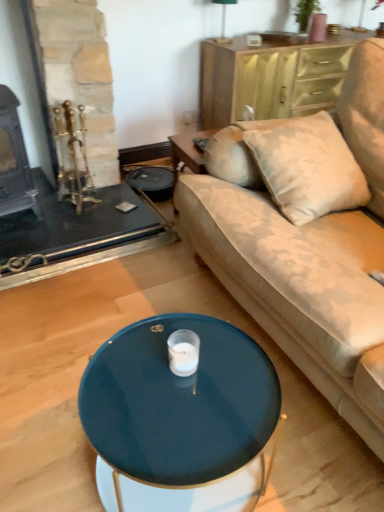
Question: Considering their positions, is velvet beige couch at center located in front of or behind green fabric lampshade at upper center?

Choices:
 (A) front
 (B) behind

Answer: (A)

Question: From their relative heights in the image, would you say velvet beige couch at center is taller or shorter than green fabric lampshade at upper center?

Choices:
 (A) short
 (B) tall

Answer: (B)

Question: Estimate the real-world distances between objects in this image. Which object is farther from the velvet beige couch at center?

Choices:
 (A) glossy dark blue coffee table at center
 (B) green fabric lampshade at upper center
 (C) wooden dresser at upper right

Answer: (B)

Question: Based on their relative distances, which object is farther from the velvet beige couch at center?

Choices:
 (A) glossy dark blue coffee table at center
 (B) green fabric lampshade at upper center
 (C) wooden dresser at upper right

Answer: (B)